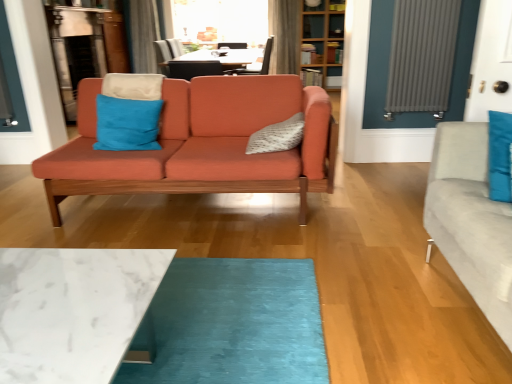
Where is `free space above white marble coffee table at lower center (from a real-world perspective)`? free space above white marble coffee table at lower center (from a real-world perspective) is located at coordinates (61, 304).